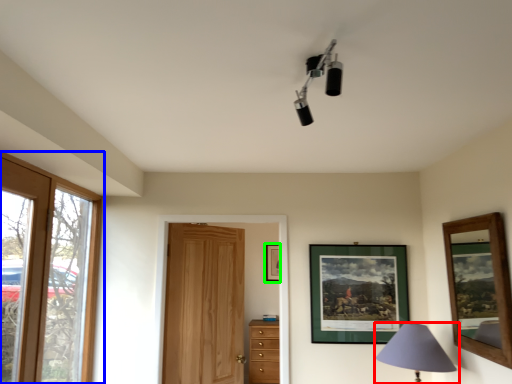
Question: Which object is positioned farthest from lamp (highlighted by a red box)? Select from window (highlighted by a blue box) and picture frame (highlighted by a green box).

Choices:
 (A) window
 (B) picture frame

Answer: (A)